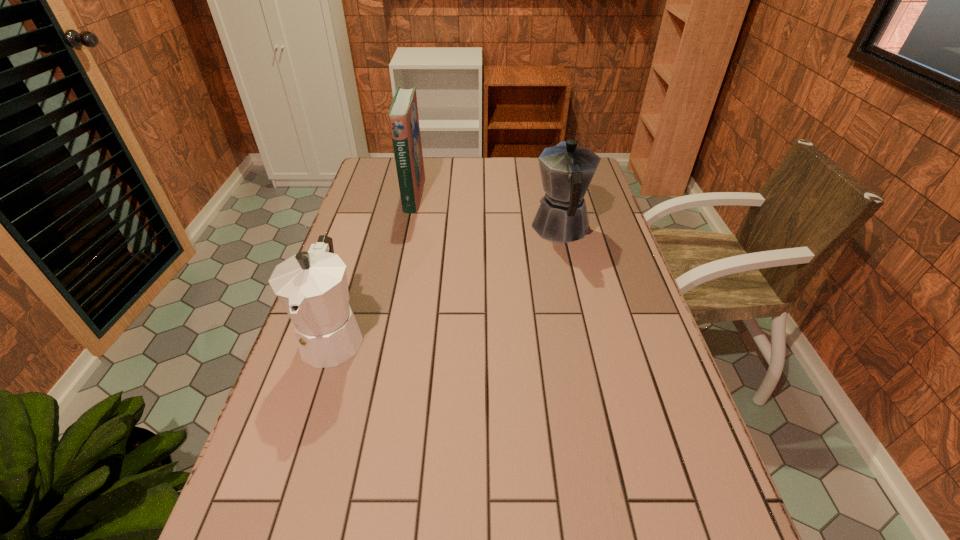
Locate an element on the screen. vacant region that satisfies the following two spatial constraints: 1. at the spout of the right coffeepot; 2. on the cover of the hardback book is located at coordinates (553, 194).

Identify the location of free region that satisfies the following two spatial constraints: 1. at the spout of the right coffeepot; 2. on the cover of the second object from left to right. (553, 194).

Identify the location of free space that satisfies the following two spatial constraints: 1. on the cover of the hardback book; 2. at the spout of the left coffeepot. The height and width of the screenshot is (540, 960). (384, 335).

Image resolution: width=960 pixels, height=540 pixels. Find the location of `vacant region that satisfies the following two spatial constraints: 1. on the cover of the second object from left to right; 2. at the spout of the nearer coffeepot`. vacant region that satisfies the following two spatial constraints: 1. on the cover of the second object from left to right; 2. at the spout of the nearer coffeepot is located at coordinates (384, 335).

You are a GUI agent. You are given a task and a screenshot of the screen. Output one action in this format:
    pyautogui.click(x=<x>, y=<y>)
    Task: Click on the free space that satisfies the following two spatial constraints: 1. on the cover of the hardback book; 2. at the spout of the nearer coffeepot
    The image size is (960, 540).
    Given the screenshot: What is the action you would take?
    384,335

You are a GUI agent. You are given a task and a screenshot of the screen. Output one action in this format:
    pyautogui.click(x=<x>, y=<y>)
    Task: Click on the vacant point that satisfies the following two spatial constraints: 1. at the spout of the farther coffeepot; 2. on the cover of the second object from right to left
    
    Given the screenshot: What is the action you would take?
    pyautogui.click(x=553, y=194)

Where is `free spot that satisfies the following two spatial constraints: 1. on the cover of the hardback book; 2. at the spout of the left coffeepot`? The image size is (960, 540). free spot that satisfies the following two spatial constraints: 1. on the cover of the hardback book; 2. at the spout of the left coffeepot is located at coordinates pyautogui.click(x=384, y=335).

The width and height of the screenshot is (960, 540). Identify the location of vacant area in the image that satisfies the following two spatial constraints: 1. on the cover of the hardback book; 2. at the spout of the nearest object. click(384, 335).

Where is `vacant area in the image that satisfies the following two spatial constraints: 1. on the cover of the second object from right to left; 2. at the spout of the right coffeepot`? The height and width of the screenshot is (540, 960). vacant area in the image that satisfies the following two spatial constraints: 1. on the cover of the second object from right to left; 2. at the spout of the right coffeepot is located at coordinates (406, 228).

Locate an element on the screen. The width and height of the screenshot is (960, 540). free region that satisfies the following two spatial constraints: 1. on the cover of the second object from right to left; 2. at the spout of the farther coffeepot is located at coordinates (406, 228).